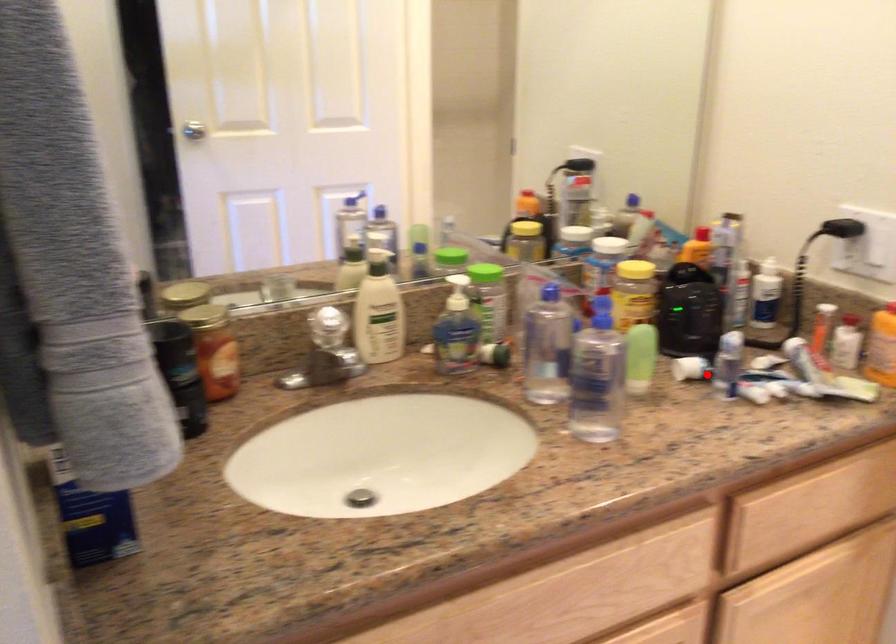
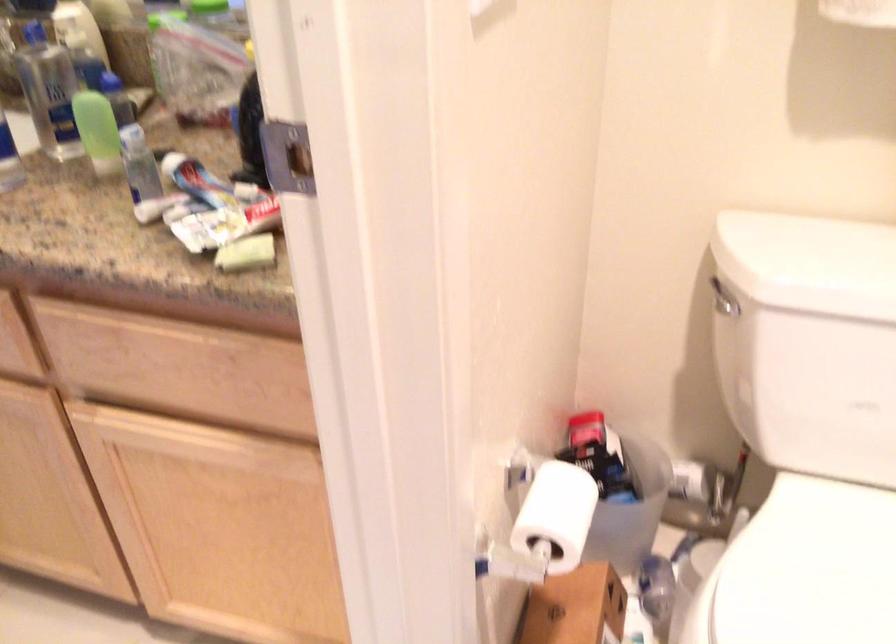
Where in the second image is the point corresponding to the highlighted location from the first image?

(197, 182)